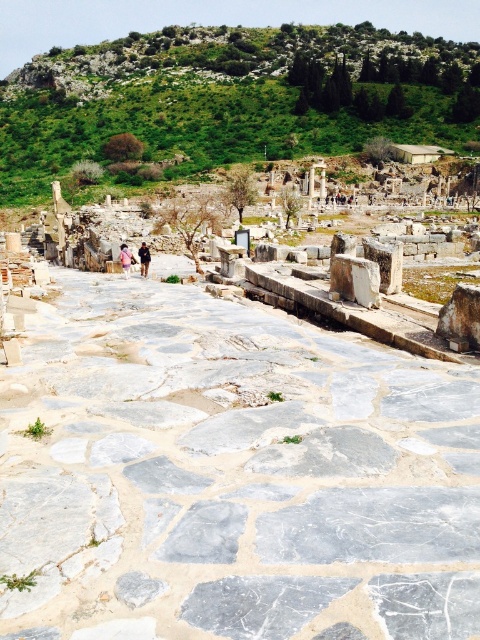
From the picture: You are an archaeologist standing at the entrance of the site. You see the gray marble stone at center and the green grassy hillside at upper center. Which object is positioned lower in the image?

The gray marble stone at center is positioned lower than the green grassy hillside at upper center.

You are an archaeologist examining the ancient site. You notice a gray marble stone at center and a pink fabric at center. Which object would you need a larger carrying container for?

The gray marble stone at center has a larger size compared to the pink fabric at center, so you would need a larger carrying container for the gray marble stone at center.

You are standing at the entrance of the archaeological site and see two points marked on the cobblestone pathway. The first point is at coordinates point (71, 458) and the second is at point (145, 257). Which point is nearer to you?

Point (71, 458) is closer to the camera than point (145, 257), so the first point is nearer to you.